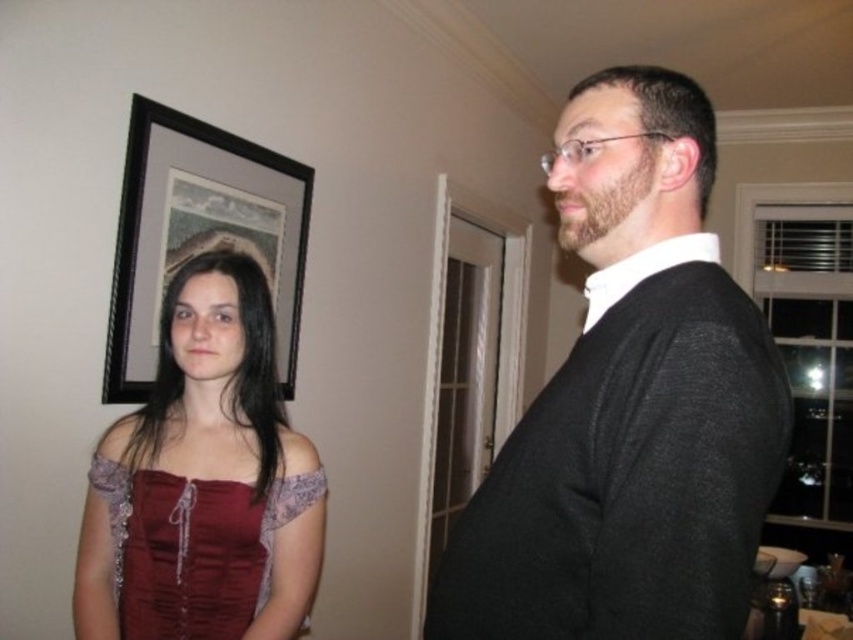
Is velvet dress at left to the right of velvet-like burgundy dress at left from the viewer's perspective?

In fact, velvet dress at left is to the left of velvet-like burgundy dress at left.

Can you confirm if velvet dress at left is positioned below velvet-like burgundy dress at left?

No.

Does point (154, 493) come closer to viewer compared to point (93, 484)?

Yes.

Identify the location of velvet dress at left. (204, 481).

Which of these two, black sweater at right or velvet-like burgundy dress at left, stands shorter?

velvet-like burgundy dress at left is shorter.

Who is higher up, black sweater at right or velvet-like burgundy dress at left?

Positioned higher is black sweater at right.

Measure the distance between black sweater at right and camera.

They are 25.16 inches apart.

Locate an element on the screen. This screenshot has height=640, width=853. black sweater at right is located at coordinates (630, 403).

Can you confirm if black sweater at right is positioned above velvet dress at left?

Correct, black sweater at right is located above velvet dress at left.

From the picture: Who is more forward, [686,438] or [322,545]?

Point [686,438] is in front.

Identify the location of black sweater at right. (630, 403).